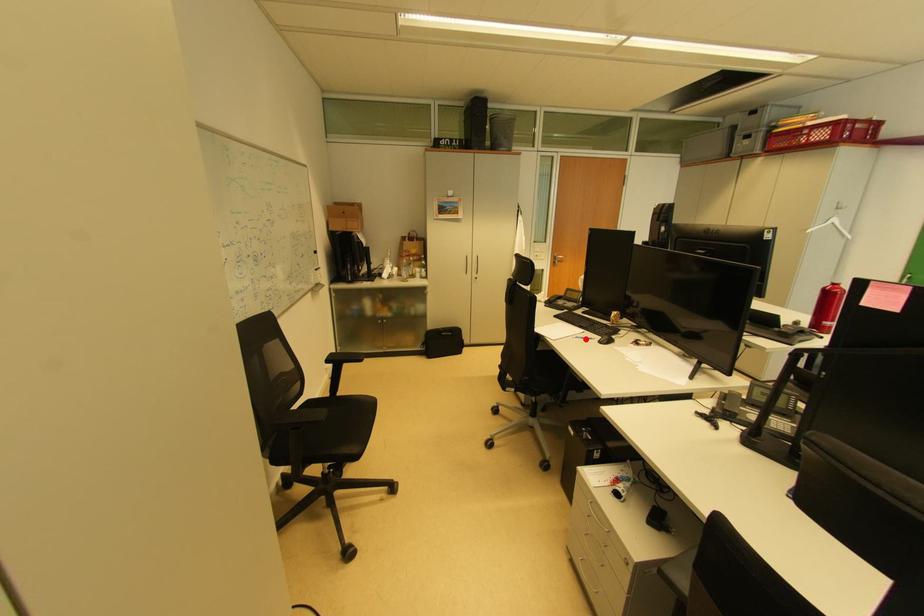
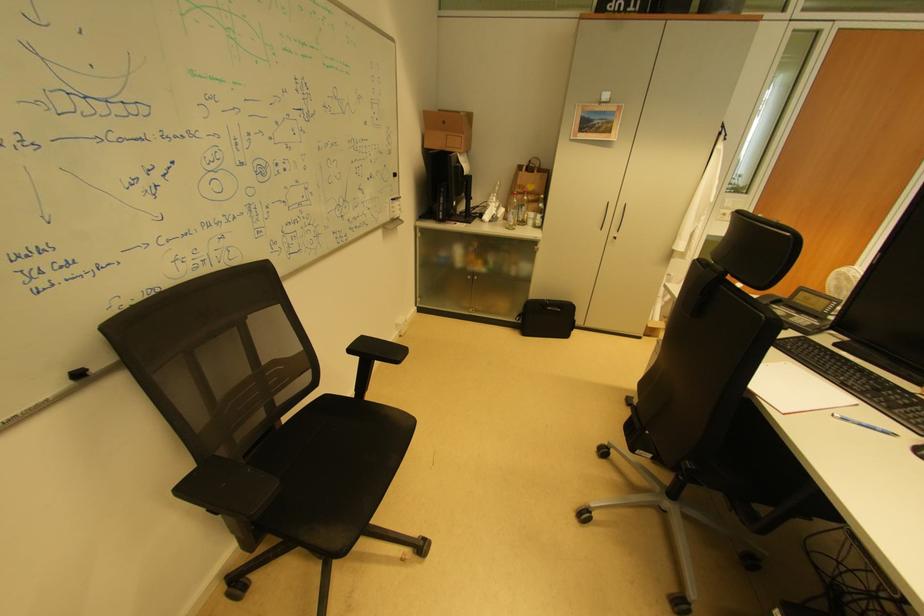
Locate, in the second image, the point that corresponds to the highlighted location in the first image.

(853, 421)